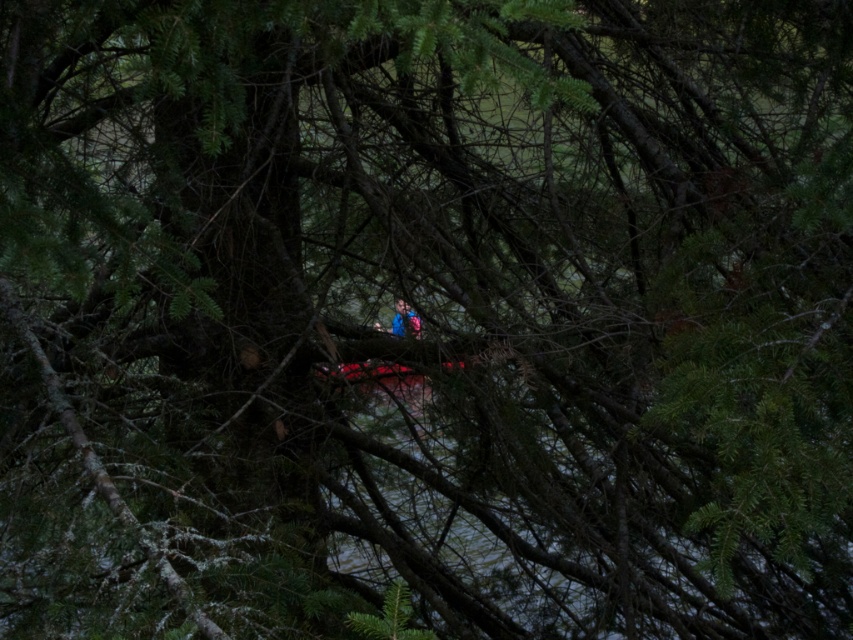
Based on the photo, you are navigating a small boat through a narrow channel between two points marked as point [372,360] and point [401,323]. Based on the scene, which point should you approach first to ensure safe passage?

Point [401,323] should be approached first since point [372,360] is behind it, meaning the channel narrows towards the latter point.

You are a photographer trying to capture a clear shot of the dark red wood canoe at center and the blue fabric at center. Given that your camera has a depth of field that can focus on objects within a 7.5 inch range, will both objects be in focus?

The dark red wood canoe at center and blue fabric at center are 7.65 inches apart. Since the distance between them exceeds the camera sensor depth of field range of 7.5 inches, both objects cannot be in focus simultaneously.

You are an observer looking through the pine branches. You notice the dark red wood canoe at center and the blue fabric at center. Which object is closer to you?

The dark red wood canoe at center is closer to you because the blue fabric at center is behind it.